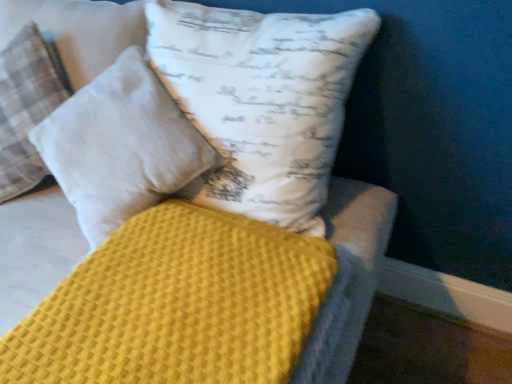
Question: Is white cotton pillow at upper center, which is counted as the 1th pillow, starting from the right, at the right side of white cotton pillow at upper left, placed as the first pillow when sorted from left to right?

Choices:
 (A) no
 (B) yes

Answer: (B)

Question: From the image's perspective, is white cotton pillow at upper center, which is counted as the second pillow, starting from the left, over white cotton pillow at upper left, the second pillow viewed from the right?

Choices:
 (A) yes
 (B) no

Answer: (B)

Question: Can you confirm if white cotton pillow at upper center, which is counted as the 1th pillow, starting from the right, is taller than white cotton pillow at upper left, the second pillow viewed from the right?

Choices:
 (A) no
 (B) yes

Answer: (A)

Question: Does white cotton pillow at upper center, which is counted as the second pillow, starting from the left, lie in front of white cotton pillow at upper left, the second pillow viewed from the right?

Choices:
 (A) yes
 (B) no

Answer: (A)

Question: Does white cotton pillow at upper center, which is counted as the second pillow, starting from the left, lie behind white cotton pillow at upper left, the second pillow viewed from the right?

Choices:
 (A) yes
 (B) no

Answer: (B)

Question: From a real-world perspective, is white cotton pillow at upper center, which is counted as the 1th pillow, starting from the right, physically below white cotton pillow at upper left, the second pillow viewed from the right?

Choices:
 (A) yes
 (B) no

Answer: (A)

Question: From a real-world perspective, is yellow waffle-textured mattress at center positioned over white cotton pillow at upper left, the second pillow viewed from the right, based on gravity?

Choices:
 (A) no
 (B) yes

Answer: (A)

Question: Can you confirm if yellow waffle-textured mattress at center is smaller than white cotton pillow at upper left, the second pillow viewed from the right?

Choices:
 (A) yes
 (B) no

Answer: (A)

Question: From the image's perspective, is yellow waffle-textured mattress at center below white cotton pillow at upper left, the second pillow viewed from the right?

Choices:
 (A) yes
 (B) no

Answer: (A)

Question: Is white cotton pillow at upper left, the second pillow viewed from the right, inside yellow waffle-textured mattress at center?

Choices:
 (A) no
 (B) yes

Answer: (A)

Question: From the image's perspective, is yellow waffle-textured mattress at center located above white cotton pillow at upper left, placed as the first pillow when sorted from left to right?

Choices:
 (A) yes
 (B) no

Answer: (B)

Question: Considering the relative sizes of yellow waffle-textured mattress at center and white cotton pillow at upper left, placed as the first pillow when sorted from left to right, in the image provided, is yellow waffle-textured mattress at center shorter than white cotton pillow at upper left, placed as the first pillow when sorted from left to right,?

Choices:
 (A) yes
 (B) no

Answer: (A)

Question: Does yellow waffle-textured mattress at center turn towards white cotton pillow at upper center, which is counted as the 1th pillow, starting from the right?

Choices:
 (A) no
 (B) yes

Answer: (A)